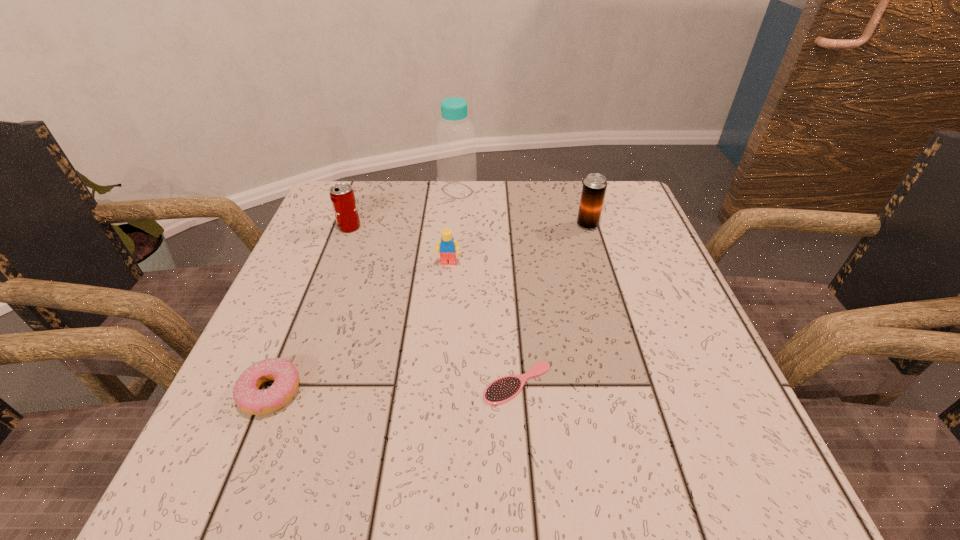
Select which object is the fifth closest to the bottle. Please provide its 2D coordinates. Your answer should be formatted as a tuple, i.e. [(x, y)], where the tuple contains the x and y coordinates of a point satisfying the conditions above.

[(249, 398)]

What are the coordinates of `the fourth closest object to the tallest object` in the screenshot? It's located at pos(504,389).